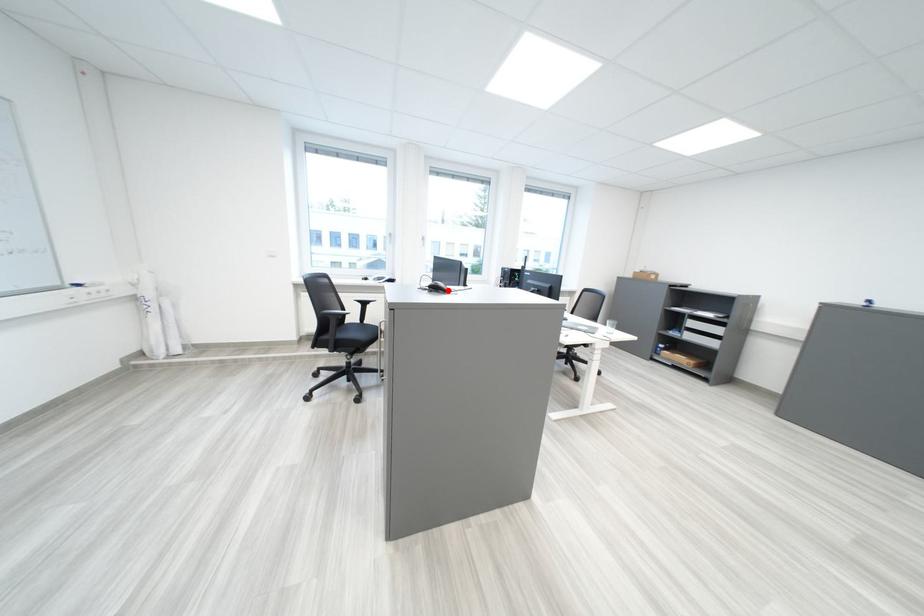
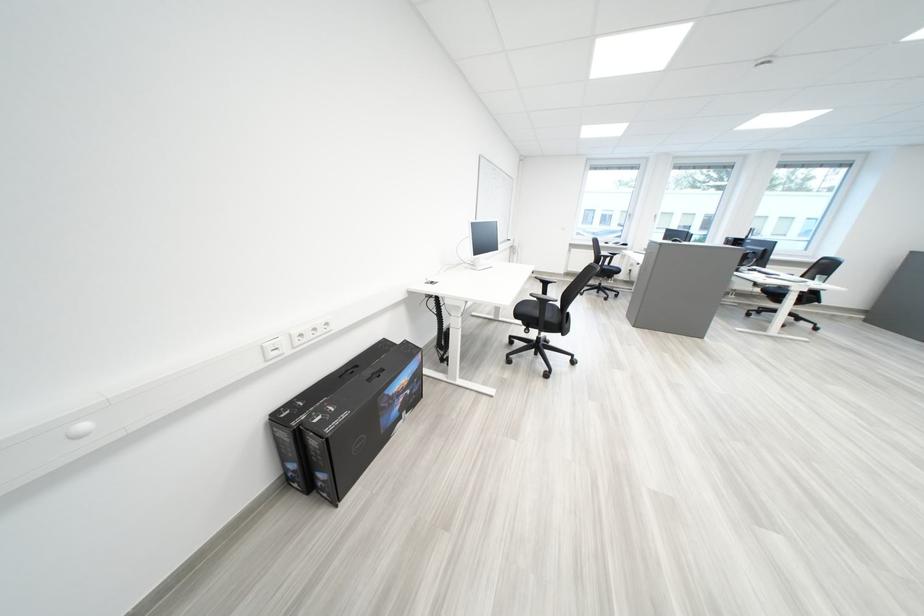
Question: I am providing you with two images of the same scene from different viewpoints. A red point is marked on the first image. Can you still see the location of the red point in image 2?

Choices:
 (A) Yes
 (B) No

Answer: (B)